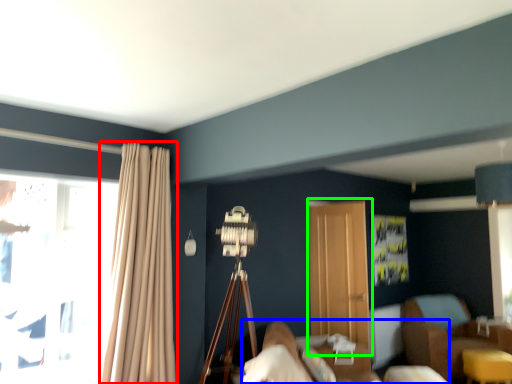
Question: Based on their relative distances, which object is farther from curtain (highlighted by a red box)? Choose from bed (highlighted by a blue box) and screen door (highlighted by a green box).

Choices:
 (A) bed
 (B) screen door

Answer: (B)